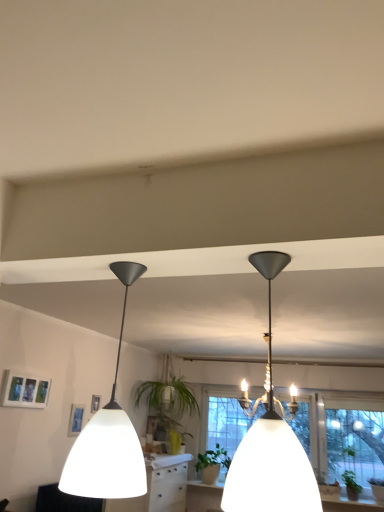
Identify the location of matte black chandelier at upper center, the 2th lamp in the left-to-right sequence. Image resolution: width=384 pixels, height=512 pixels. (270, 445).

Image resolution: width=384 pixels, height=512 pixels. What do you see at coordinates (169, 402) in the screenshot?
I see `green leafy plant at center` at bounding box center [169, 402].

Image resolution: width=384 pixels, height=512 pixels. Find the location of `matte black lampshade at left, the 2th lamp in the right-to-left sequence`. matte black lampshade at left, the 2th lamp in the right-to-left sequence is located at coordinates (108, 437).

From the image's perspective, is matte white picture frame at upper left beneath green matte plant at lower right, which is counted as the first plant, starting from the right?

No.

Is matte white picture frame at upper left oriented away from green matte plant at lower right, placed as the first plant when sorted from front to back?

That's not correct — matte white picture frame at upper left is not looking away from green matte plant at lower right, placed as the first plant when sorted from front to back.

Find the location of a particular element. The image size is (384, 512). plant that is the 2nd object to the right of the matte white picture frame at upper left, starting at the anchor is located at coordinates (351, 484).

Is matte white picture frame at upper left with green matte plant at lower right, placed as the 2th plant when sorted from left to right?

matte white picture frame at upper left is not next to green matte plant at lower right, placed as the 2th plant when sorted from left to right, and they're not touching.

From the picture: Is there a large distance between matte black lampshade at left, the 2th lamp in the right-to-left sequence, and matte white picture frame at upper left?

matte black lampshade at left, the 2th lamp in the right-to-left sequence, is positioned a significant distance from matte white picture frame at upper left.

From the image's perspective, is matte black lampshade at left, the 2th lamp in the right-to-left sequence, beneath matte white picture frame at upper left?

Incorrect, from the image's perspective, matte black lampshade at left, the 2th lamp in the right-to-left sequence, is higher than matte white picture frame at upper left.

Is point (132, 487) in front of point (23, 394)?

That is True.

Could you tell me if green leafy plant at center is facing green matte plant at center, marked as the 2th plant in a front-to-back arrangement?

No, green leafy plant at center does not turn towards green matte plant at center, marked as the 2th plant in a front-to-back arrangement.

Is point (157, 418) positioned behind point (205, 459)?

No, (157, 418) is in front of (205, 459).

How different are the orientations of green leafy plant at center and green matte plant at center, arranged as the first plant when viewed from the left, in degrees?

There is a 90-degree angle between the facing directions of green leafy plant at center and green matte plant at center, arranged as the first plant when viewed from the left.

Considering the sizes of objects green leafy plant at center and green matte plant at center, arranged as the first plant when viewed from the back, in the image provided, who is taller, green leafy plant at center or green matte plant at center, arranged as the first plant when viewed from the back,?

With more height is green leafy plant at center.

Is green leafy plant at center with matte black chandelier at upper center, the 1th lamp positioned from the right?

There is a gap between green leafy plant at center and matte black chandelier at upper center, the 1th lamp positioned from the right.

Can you confirm if green leafy plant at center is shorter than matte black chandelier at upper center, the 1th lamp positioned from the right?

No.

From a real-world perspective, is green leafy plant at center on matte black chandelier at upper center, the 2th lamp in the left-to-right sequence?

No, from a real-world perspective, green leafy plant at center is not above matte black chandelier at upper center, the 2th lamp in the left-to-right sequence.

Considering the sizes of objects green leafy plant at center and matte black chandelier at upper center, the 2th lamp in the left-to-right sequence, in the image provided, who is thinner, green leafy plant at center or matte black chandelier at upper center, the 2th lamp in the left-to-right sequence,?

matte black chandelier at upper center, the 2th lamp in the left-to-right sequence.

Based on the photo, is green matte plant at center, arranged as the first plant when viewed from the back, positioned beyond the bounds of matte black chandelier at upper center, the 2th lamp in the left-to-right sequence?

Absolutely, green matte plant at center, arranged as the first plant when viewed from the back, is external to matte black chandelier at upper center, the 2th lamp in the left-to-right sequence.

From a real-world perspective, is green matte plant at center, arranged as the first plant when viewed from the left, under matte black chandelier at upper center, the 2th lamp in the left-to-right sequence?

Yes, from a real-world perspective, green matte plant at center, arranged as the first plant when viewed from the left, is below matte black chandelier at upper center, the 2th lamp in the left-to-right sequence.

Between green matte plant at center, arranged as the first plant when viewed from the back, and matte black chandelier at upper center, the 1th lamp positioned from the right, which one appears on the right side from the viewer's perspective?

matte black chandelier at upper center, the 1th lamp positioned from the right, is more to the right.

Is matte black chandelier at upper center, the 2th lamp in the left-to-right sequence, at the left side of green matte plant at center, the 2th plant from the right?

Incorrect, matte black chandelier at upper center, the 2th lamp in the left-to-right sequence, is not on the left side of green matte plant at center, the 2th plant from the right.

Based on the photo, from the image's perspective, is matte black chandelier at upper center, the 1th lamp positioned from the right, on green matte plant at center, the 2th plant from the right?

Yes, from the image's perspective, matte black chandelier at upper center, the 1th lamp positioned from the right, is over green matte plant at center, the 2th plant from the right.

Between matte black chandelier at upper center, the 1th lamp positioned from the right, and green matte plant at center, the 2th plant from the right, which one has smaller size?

green matte plant at center, the 2th plant from the right, is smaller.

How distant is matte black chandelier at upper center, the 1th lamp positioned from the right, from green matte plant at center, marked as the 2th plant in a front-to-back arrangement?

A distance of 4.20 meters exists between matte black chandelier at upper center, the 1th lamp positioned from the right, and green matte plant at center, marked as the 2th plant in a front-to-back arrangement.

Is green matte plant at lower right, placed as the 2th plant when sorted from left to right, positioned beyond the bounds of green matte plant at center, marked as the 2th plant in a front-to-back arrangement?

Yes, green matte plant at lower right, placed as the 2th plant when sorted from left to right, is located beyond the bounds of green matte plant at center, marked as the 2th plant in a front-to-back arrangement.

How far apart are green matte plant at lower right, the 2th plant positioned from the back, and green matte plant at center, arranged as the first plant when viewed from the back?

green matte plant at lower right, the 2th plant positioned from the back, and green matte plant at center, arranged as the first plant when viewed from the back, are 4.52 feet apart.

From the image's perspective, is green matte plant at lower right, placed as the 2th plant when sorted from left to right, located above green matte plant at center, arranged as the first plant when viewed from the back?

Indeed, from the image's perspective, green matte plant at lower right, placed as the 2th plant when sorted from left to right, is shown above green matte plant at center, arranged as the first plant when viewed from the back.

Is green matte plant at center, arranged as the first plant when viewed from the left, at the back of green matte plant at lower right, placed as the 2th plant when sorted from left to right?

That's not correct — green matte plant at lower right, placed as the 2th plant when sorted from left to right, is not looking away from green matte plant at center, arranged as the first plant when viewed from the left.

From the matte white picture frame at upper left, count 1st plants backward and point to it. Please provide its 2D coordinates.

[(351, 484)]

What are the coordinates of `the 1st lamp counting from the right side of the matte white picture frame at upper left` in the screenshot? It's located at (108, 437).

Based on their spatial positions, is green matte plant at lower right, placed as the first plant when sorted from front to back, or green leafy plant at center further from transparent glass window at center?

Among the two, green leafy plant at center is located further to transparent glass window at center.

Based on their spatial positions, is green leafy plant at center or matte black chandelier at upper center, the 2th lamp in the left-to-right sequence, further from green matte plant at lower right, which is counted as the first plant, starting from the right?

matte black chandelier at upper center, the 2th lamp in the left-to-right sequence, is further to green matte plant at lower right, which is counted as the first plant, starting from the right.

When comparing their distances from green matte plant at center, arranged as the first plant when viewed from the left, does green matte plant at lower right, placed as the 2th plant when sorted from left to right, or transparent glass window at center seem further?

green matte plant at lower right, placed as the 2th plant when sorted from left to right, is positioned further to the anchor green matte plant at center, arranged as the first plant when viewed from the left.

Which object lies nearer to the anchor point matte black chandelier at upper center, the 2th lamp in the left-to-right sequence, matte black lampshade at left, the first lamp when ordered from left to right, or green matte plant at center, marked as the 2th plant in a front-to-back arrangement?

matte black lampshade at left, the first lamp when ordered from left to right, lies closer to matte black chandelier at upper center, the 2th lamp in the left-to-right sequence, than the other object.

Based on their spatial positions, is green leafy plant at center or matte black lampshade at left, the first lamp when ordered from left to right, further from green matte plant at center, marked as the 2th plant in a front-to-back arrangement?

matte black lampshade at left, the first lamp when ordered from left to right.

From the image, which object appears to be farther from green leafy plant at center, transparent glass window at center or green matte plant at center, the 2th plant from the right?

transparent glass window at center is positioned further to the anchor green leafy plant at center.

Looking at this image, when comparing their distances from green matte plant at lower right, the 2th plant positioned from the back, does green matte plant at center, the 2th plant from the right, or matte white picture frame at upper left seem further?

matte white picture frame at upper left is positioned further to the anchor green matte plant at lower right, the 2th plant positioned from the back.

Looking at the image, which one is located further to matte black chandelier at upper center, the 2th lamp in the left-to-right sequence, matte white picture frame at upper left or green leafy plant at center?

green leafy plant at center.

Where is `window between matte black lampshade at left, the first lamp when ordered from left to right, and green leafy plant at center in the front-back direction`? window between matte black lampshade at left, the first lamp when ordered from left to right, and green leafy plant at center in the front-back direction is located at coordinates pyautogui.click(x=352, y=440).

This screenshot has width=384, height=512. I want to click on lamp between matte black chandelier at upper center, the 1th lamp positioned from the right, and matte white picture frame at upper left from front to back, so click(108, 437).

The width and height of the screenshot is (384, 512). In order to click on houseplant between matte white picture frame at upper left and green matte plant at center, marked as the 2th plant in a front-to-back arrangement, in the front-back direction in this screenshot , I will do `click(169, 402)`.

Locate an element on the screen. The width and height of the screenshot is (384, 512). picture frame positioned between matte black chandelier at upper center, the 2th lamp in the left-to-right sequence, and green leafy plant at center from near to far is located at coordinates (25, 390).